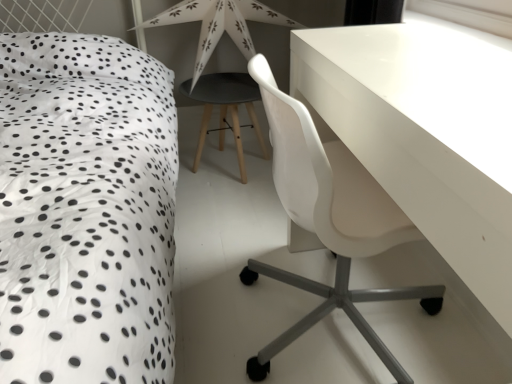
Question: Is white paper star at upper center in contact with matte black stool at center?

Choices:
 (A) yes
 (B) no

Answer: (A)

Question: Considering the relative sizes of white paper star at upper center and matte black stool at center in the image provided, is white paper star at upper center bigger than matte black stool at center?

Choices:
 (A) no
 (B) yes

Answer: (B)

Question: Is white paper star at upper center further to camera compared to matte black stool at center?

Choices:
 (A) yes
 (B) no

Answer: (B)

Question: Is white paper star at upper center closer to camera compared to matte black stool at center?

Choices:
 (A) yes
 (B) no

Answer: (A)

Question: Can we say white paper star at upper center lies outside matte black stool at center?

Choices:
 (A) no
 (B) yes

Answer: (B)

Question: Can you confirm if white paper star at upper center is positioned to the right of matte black stool at center?

Choices:
 (A) yes
 (B) no

Answer: (A)

Question: Is white dotted fabric at left oriented away from transparent plastic window screen at upper right?

Choices:
 (A) yes
 (B) no

Answer: (B)

Question: Considering the relative positions of white dotted fabric at left and transparent plastic window screen at upper right in the image provided, is white dotted fabric at left behind transparent plastic window screen at upper right?

Choices:
 (A) yes
 (B) no

Answer: (B)

Question: Could transparent plastic window screen at upper right be considered to be inside white dotted fabric at left?

Choices:
 (A) no
 (B) yes

Answer: (A)

Question: Would you say white dotted fabric at left is a long distance from transparent plastic window screen at upper right?

Choices:
 (A) yes
 (B) no

Answer: (A)

Question: Can you see white dotted fabric at left touching transparent plastic window screen at upper right?

Choices:
 (A) no
 (B) yes

Answer: (A)

Question: Is white dotted fabric at left shorter than transparent plastic window screen at upper right?

Choices:
 (A) yes
 (B) no

Answer: (B)

Question: From the image's perspective, does matte black stool at center appear lower than transparent plastic window screen at upper right?

Choices:
 (A) no
 (B) yes

Answer: (B)